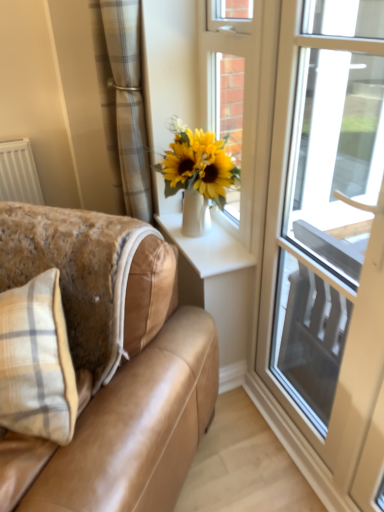
Question: Does white glossy vase at upper center lie behind transparent glass door at right?

Choices:
 (A) yes
 (B) no

Answer: (A)

Question: Is white glossy vase at upper center oriented towards transparent glass door at right?

Choices:
 (A) no
 (B) yes

Answer: (A)

Question: From a real-world perspective, does white glossy vase at upper center sit lower than transparent glass door at right?

Choices:
 (A) no
 (B) yes

Answer: (B)

Question: Is transparent glass door at right surrounded by white glossy vase at upper center?

Choices:
 (A) yes
 (B) no

Answer: (B)

Question: Can you confirm if white glossy vase at upper center is shorter than transparent glass door at right?

Choices:
 (A) yes
 (B) no

Answer: (A)

Question: Does point (241, 117) appear closer or farther from the camera than point (352, 71)?

Choices:
 (A) farther
 (B) closer

Answer: (B)

Question: Considering the positions of white glossy door at upper center and transparent glass door at right in the image, is white glossy door at upper center taller or shorter than transparent glass door at right?

Choices:
 (A) tall
 (B) short

Answer: (B)

Question: From a real-world perspective, is white glossy door at upper center physically located above or below transparent glass door at right?

Choices:
 (A) above
 (B) below

Answer: (A)

Question: Is white glossy door at upper center situated inside transparent glass door at right or outside?

Choices:
 (A) inside
 (B) outside

Answer: (B)

Question: In terms of height, does white glossy door at upper center look taller or shorter compared to plaid fabric curtain at upper left?

Choices:
 (A) short
 (B) tall

Answer: (B)

Question: In the image, is white glossy door at upper center positioned in front of or behind plaid fabric curtain at upper left?

Choices:
 (A) behind
 (B) front

Answer: (B)

Question: Is white glossy door at upper center inside the boundaries of plaid fabric curtain at upper left, or outside?

Choices:
 (A) outside
 (B) inside

Answer: (A)

Question: In terms of width, does white glossy door at upper center look wider or thinner when compared to plaid fabric curtain at upper left?

Choices:
 (A) thin
 (B) wide

Answer: (A)

Question: Is plaid fabric curtain at upper left to the left or to the right of transparent glass door at right in the image?

Choices:
 (A) left
 (B) right

Answer: (A)

Question: From the image's perspective, is plaid fabric curtain at upper left located above or below transparent glass door at right?

Choices:
 (A) above
 (B) below

Answer: (A)